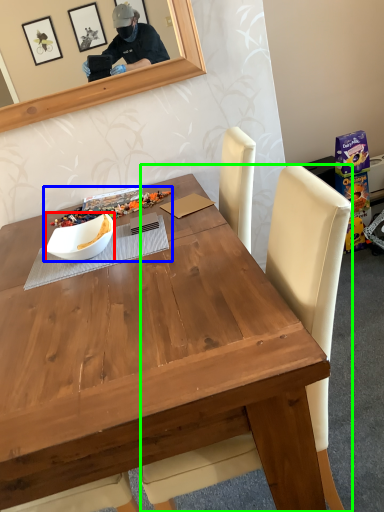
Question: Considering the real-world distances, which object is farthest from bowl (highlighted by a red box)? fruit dish (highlighted by a blue box) or chair (highlighted by a green box)?

Choices:
 (A) fruit dish
 (B) chair

Answer: (B)